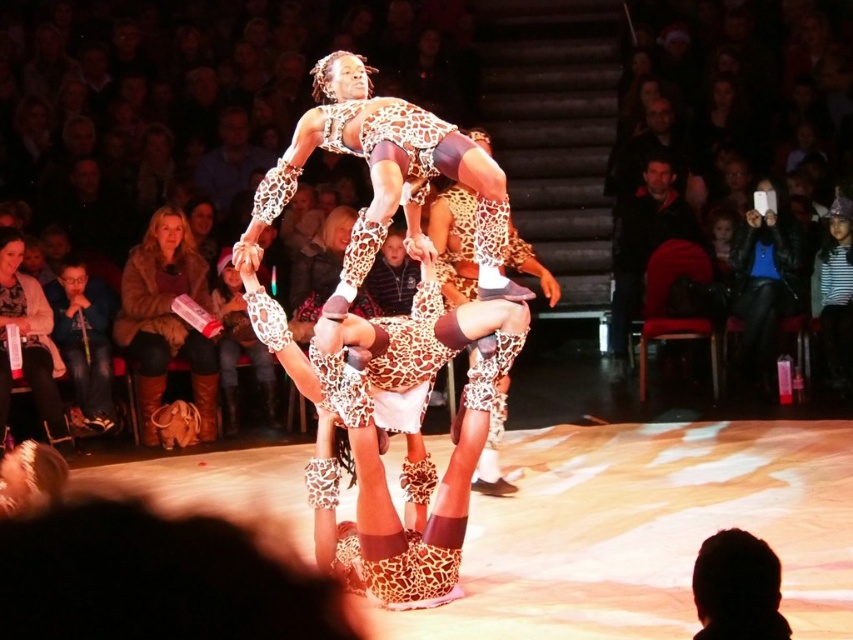
Is point (131, 304) more distant than point (71, 310)?

Yes, point (131, 304) is farther from viewer.

Can you confirm if leather boots at lower left is positioned to the right of matte brown leather jacket at left?

Indeed, leather boots at lower left is positioned on the right side of matte brown leather jacket at left.

From the picture: Who is more forward, (134, 378) or (80, 340)?

Positioned in front is point (134, 378).

At what (x,y) coordinates should I click in order to perform the action: click on leather boots at lower left. Please return your answer as a coordinate pair (x, y). The width and height of the screenshot is (853, 640). Looking at the image, I should click on (166, 321).